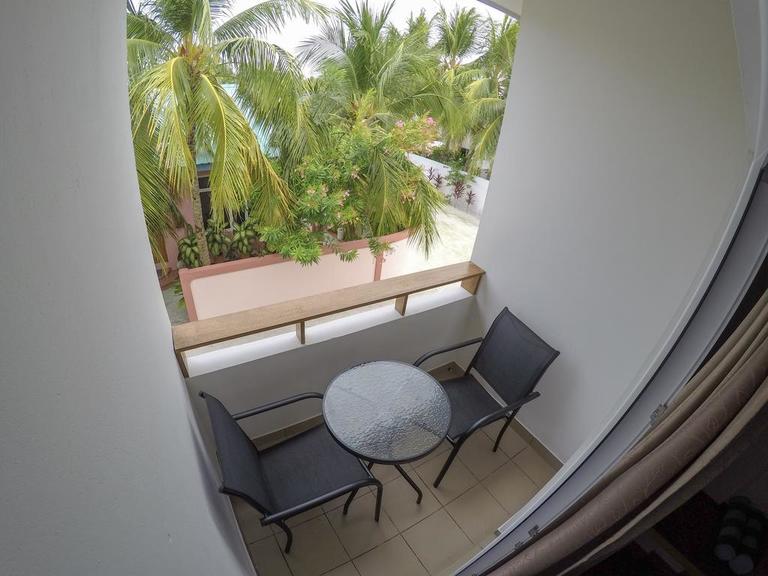
Find the location of a particular element. wall is located at coordinates (257, 276), (399, 255).